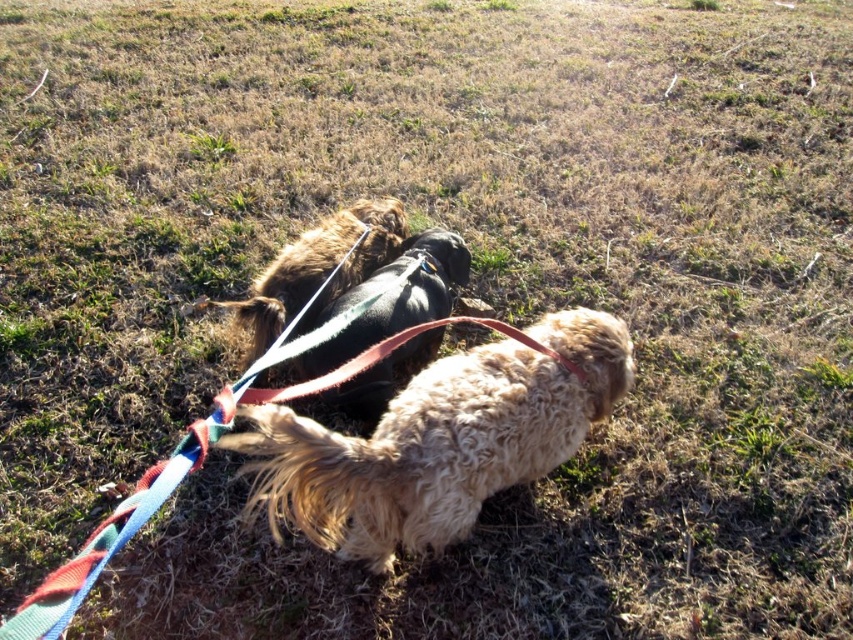
Question: Does shiny black dog at center appear on the right side of fuzzy brown dog at center?

Choices:
 (A) no
 (B) yes

Answer: (B)

Question: Can you confirm if multicolored fabric leash at center is thinner than fuzzy brown dog at center?

Choices:
 (A) yes
 (B) no

Answer: (B)

Question: Which of the following is the closest to the observer?

Choices:
 (A) multicolored fabric leash at center
 (B) shiny black dog at center

Answer: (A)

Question: Which point is farther from the camera taking this photo?

Choices:
 (A) (566, 406)
 (B) (380, 285)

Answer: (B)

Question: Does multicolored fabric leash at center appear under shiny black dog at center?

Choices:
 (A) yes
 (B) no

Answer: (A)

Question: Based on their relative distances, which object is farther from the fuzzy fur dog at center?

Choices:
 (A) multicolored fabric leash at center
 (B) fuzzy brown dog at center

Answer: (B)